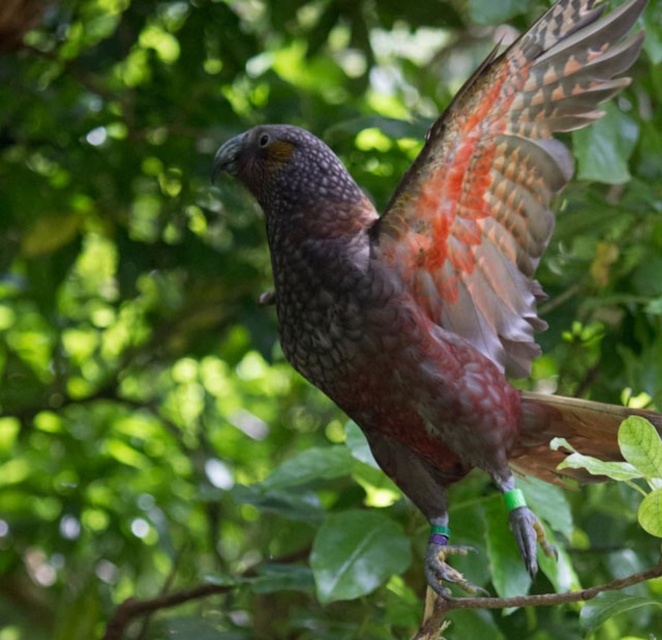
Which is behind, point (459, 461) or point (461, 131)?

The point (459, 461) is more distant.

The width and height of the screenshot is (662, 640). What do you see at coordinates (444, 273) in the screenshot? I see `speckled feathered bird at center` at bounding box center [444, 273].

What do you see at coordinates (444, 273) in the screenshot? This screenshot has height=640, width=662. I see `speckled feathered bird at center` at bounding box center [444, 273].

You are a GUI agent. You are given a task and a screenshot of the screen. Output one action in this format:
    pyautogui.click(x=<x>, y=<y>)
    Task: Click on the speckled feathered bird at center
    The width and height of the screenshot is (662, 640).
    Given the screenshot: What is the action you would take?
    pyautogui.click(x=444, y=273)